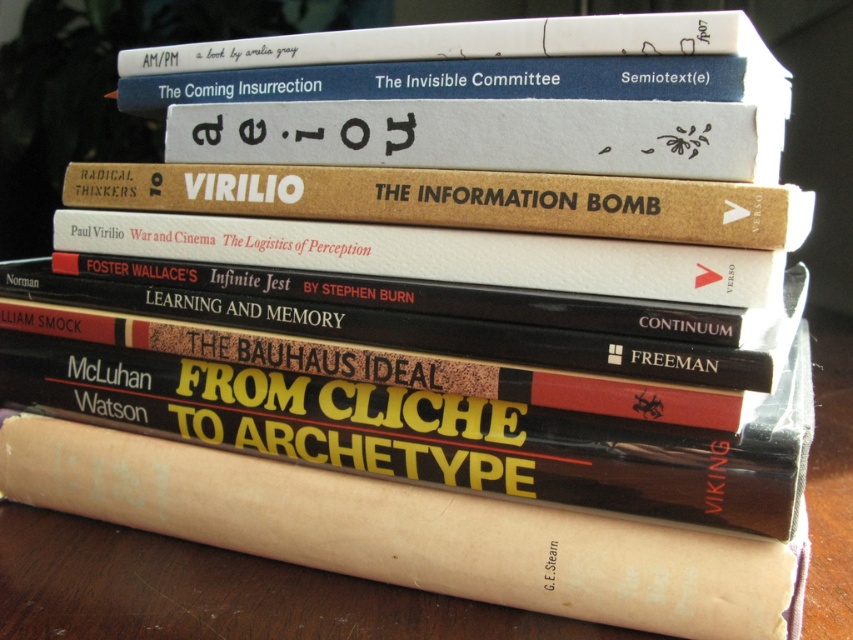
Question: From the image, what is the correct spatial relationship of brown paper book at center in relation to brown cardboard book at center?

Choices:
 (A) above
 (B) below

Answer: (B)

Question: In this image, where is brown paper book at center located relative to brown cardboard book at center?

Choices:
 (A) above
 (B) below

Answer: (B)

Question: Is brown paper book at center below brown cardboard book at center?

Choices:
 (A) yes
 (B) no

Answer: (A)

Question: Which point is farther to the camera?

Choices:
 (A) brown paper book at center
 (B) brown cardboard book at center

Answer: (A)

Question: Which point is farther from the camera taking this photo?

Choices:
 (A) (647, 540)
 (B) (546, 186)

Answer: (B)